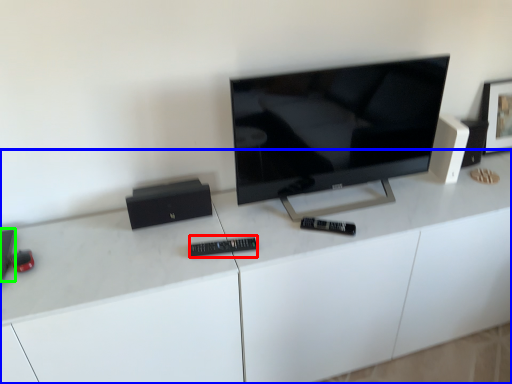
Question: Which is nearer to the control (highlighted by a red box)? desk (highlighted by a blue box) or speaker (highlighted by a green box).

Choices:
 (A) desk
 (B) speaker

Answer: (A)